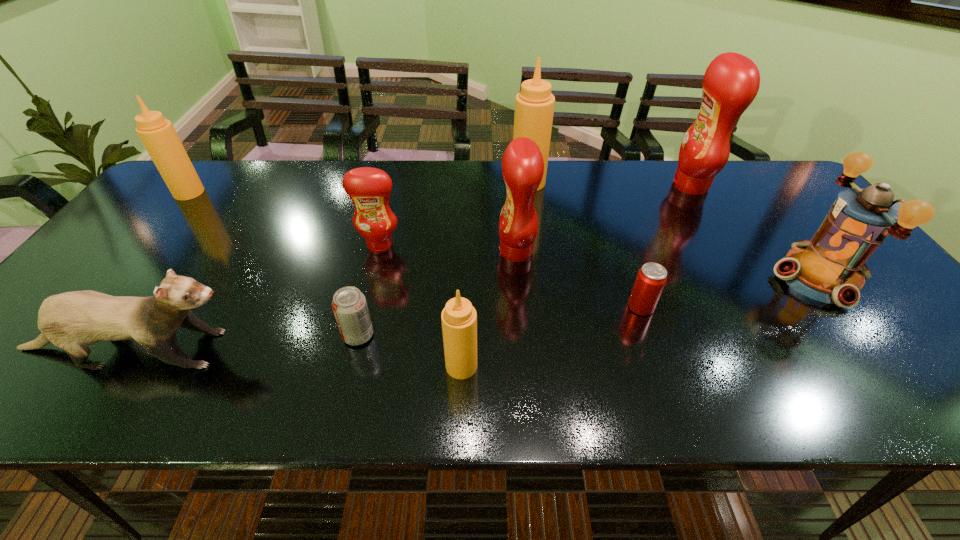
Point out which tan condiment is positioned as the nearest to the gray ferret. Please provide its 2D coordinates. Your answer should be formatted as a tuple, i.e. [(x, y)], where the tuple contains the x and y coordinates of a point satisfying the conditions above.

[(459, 318)]

This screenshot has width=960, height=540. I want to click on vacant area that satisfies the following two spatial constraints: 1. on the front-facing side of the lantern; 2. on the front side of the gray soda can, so click(x=862, y=335).

This screenshot has height=540, width=960. Identify the location of free space that satisfies the following two spatial constraints: 1. on the label side of the leftmost red condiment; 2. on the right side of the soda can. (358, 335).

The width and height of the screenshot is (960, 540). What are the coordinates of `free space that satisfies the following two spatial constraints: 1. on the label side of the smallest red condiment; 2. on the right side of the soda can` in the screenshot? It's located at (358, 335).

Locate an element on the screen. vacant area that satisfies the following two spatial constraints: 1. on the label side of the second red condiment from left to right; 2. on the front side of the second tan condiment from right to left is located at coordinates (526, 366).

In order to click on blank space that satisfies the following two spatial constraints: 1. on the label side of the leftmost red condiment; 2. on the left side of the soda can in this screenshot , I will do `click(358, 335)`.

Image resolution: width=960 pixels, height=540 pixels. Find the location of `free space that satisfies the following two spatial constraints: 1. on the label side of the smallest red condiment; 2. on the right side of the soda can`. free space that satisfies the following two spatial constraints: 1. on the label side of the smallest red condiment; 2. on the right side of the soda can is located at coordinates (358, 335).